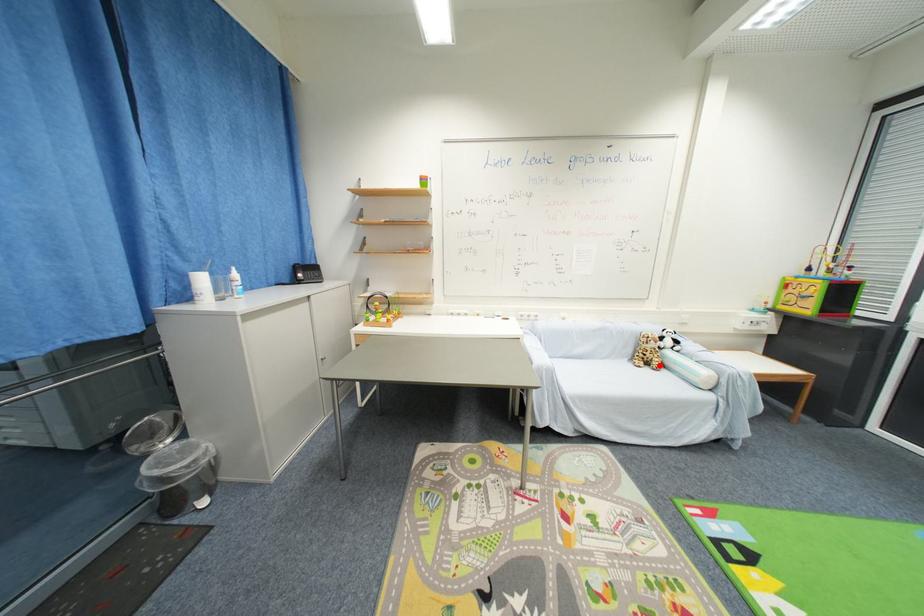
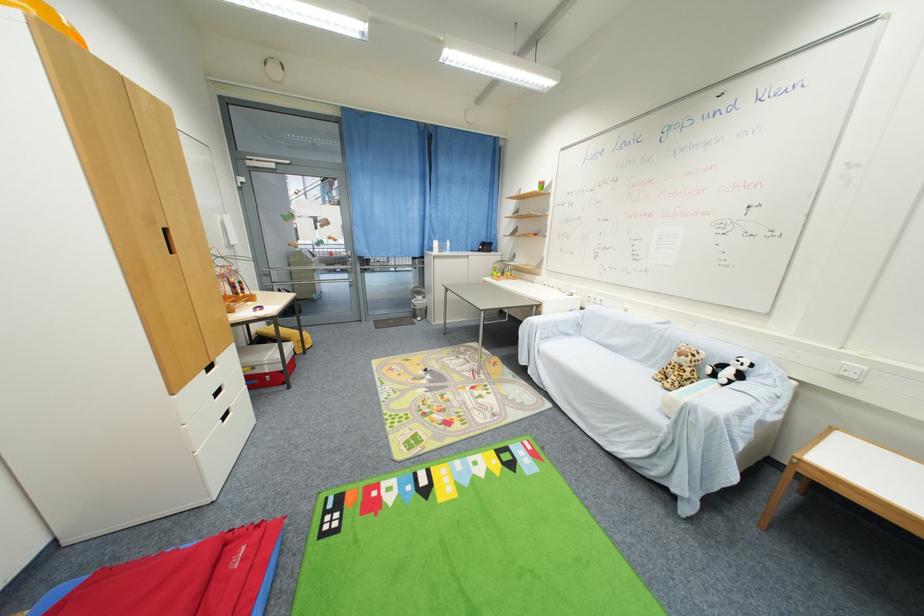
Question: I am providing you with two images of the same scene from different viewpoints. A red point is marked on the first image. Is the red point's position out of view in image 2?

Choices:
 (A) Yes
 (B) No

Answer: (B)